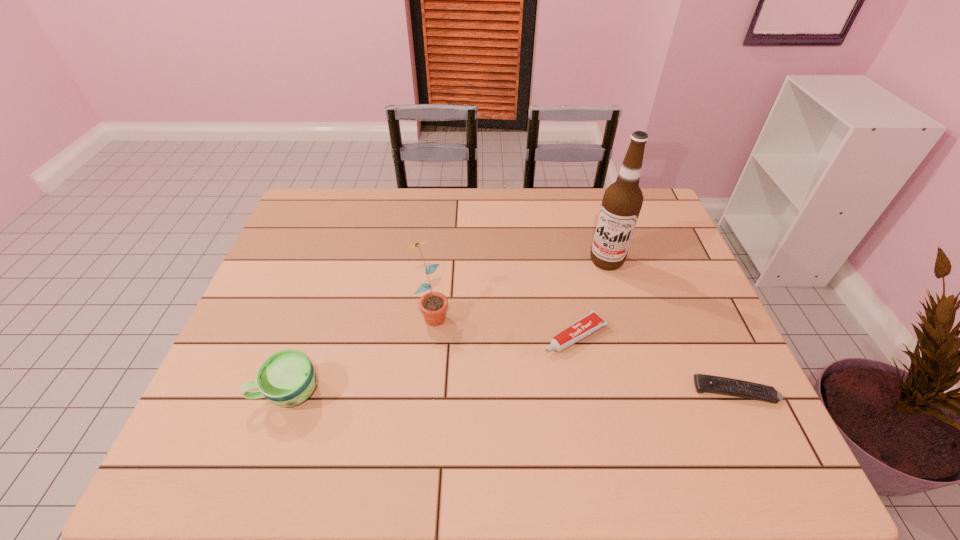
You are a GUI agent. You are given a task and a screenshot of the screen. Output one action in this format:
    pyautogui.click(x=<x>, y=<y>)
    Task: Click on the free point between the second shortest object and the third tallest object
    The height and width of the screenshot is (540, 960).
    Given the screenshot: What is the action you would take?
    pyautogui.click(x=432, y=363)

Identify which object is the fourth closest to the remote control. Please provide its 2D coordinates. Your answer should be formatted as a tuple, i.e. [(x, y)], where the tuple contains the x and y coordinates of a point satisfying the conditions above.

[(287, 378)]

Locate an element on the screen. The image size is (960, 540). object that is the fourth closest to the leftmost object is located at coordinates (704, 383).

Identify the location of blank space that satisfies the following two spatial constraints: 1. on the back side of the rightmost object; 2. on the right side of the third tallest object. The height and width of the screenshot is (540, 960). (288, 391).

Identify the location of vacant region that satisfies the following two spatial constraints: 1. on the front side of the second shortest object; 2. on the left side of the second tallest object. This screenshot has width=960, height=540. (429, 334).

This screenshot has width=960, height=540. Find the location of `vacant space that satisfies the following two spatial constraints: 1. on the back side of the cup; 2. on the left side of the fourth shortest object`. vacant space that satisfies the following two spatial constraints: 1. on the back side of the cup; 2. on the left side of the fourth shortest object is located at coordinates pyautogui.click(x=315, y=313).

The image size is (960, 540). Find the location of `free point that satisfies the following two spatial constraints: 1. on the back side of the cup; 2. on the right side of the tallest object`. free point that satisfies the following two spatial constraints: 1. on the back side of the cup; 2. on the right side of the tallest object is located at coordinates (333, 261).